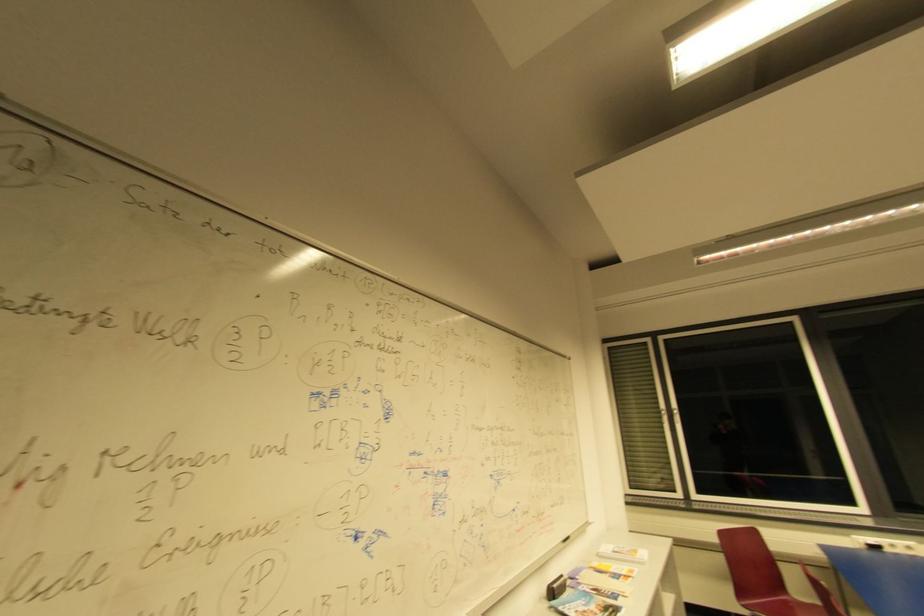
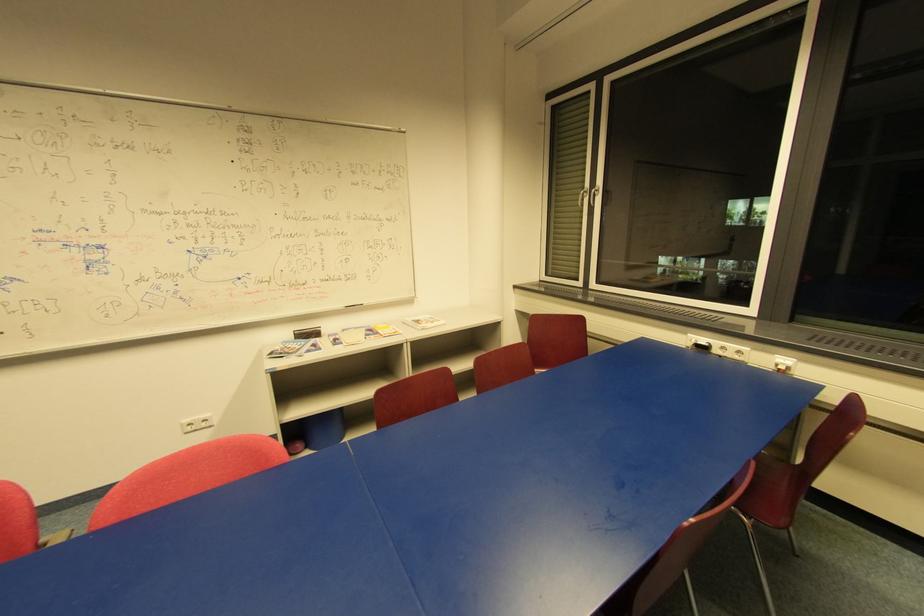
In the second image, find the point that corresponds to (893,552) in the first image.

(720, 352)